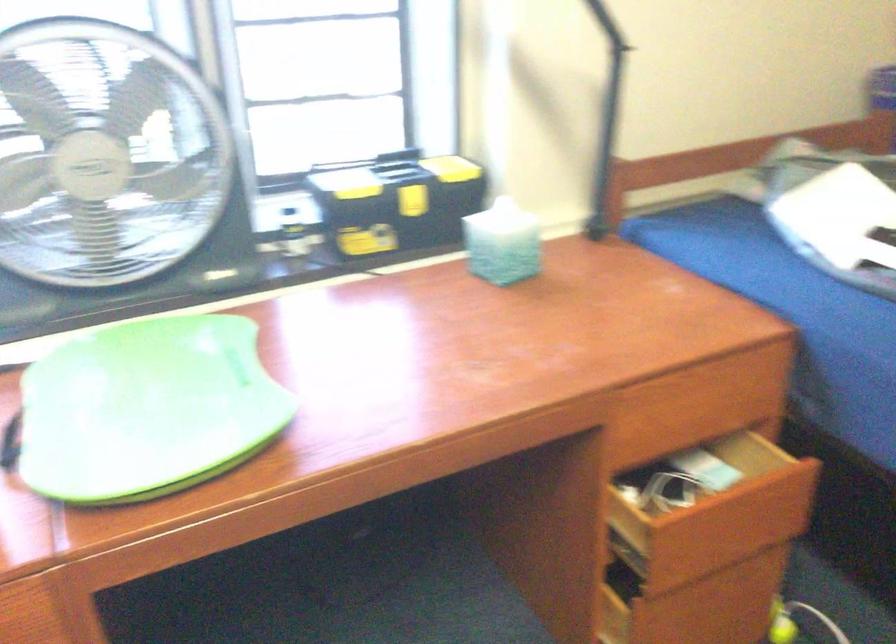
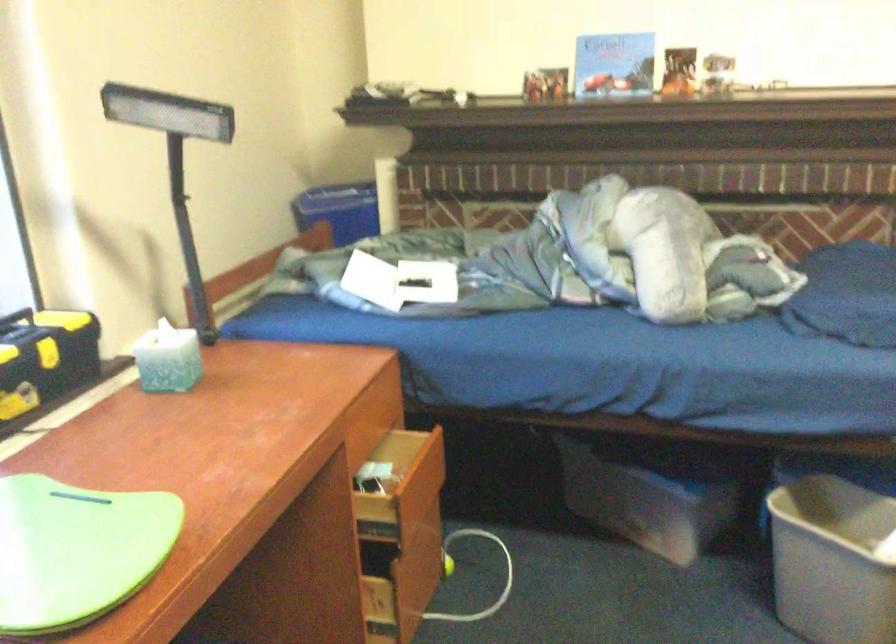
Where in the second image is the point corresponding to point 734,536 from the first image?

(419, 489)